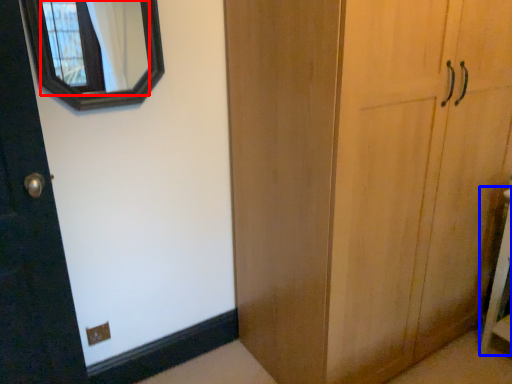
Question: Which object is further to the camera taking this photo, mirror (highlighted by a red box) or vanity (highlighted by a blue box)?

Choices:
 (A) mirror
 (B) vanity

Answer: (B)